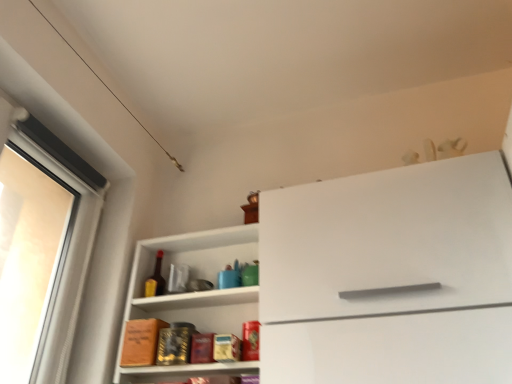
Question: Considering the positions of point (153, 284) and point (373, 357), is point (153, 284) closer or farther from the camera than point (373, 357)?

Choices:
 (A) closer
 (B) farther

Answer: (B)

Question: From the image's perspective, is matte glass bottle at center located above or below white matte cabinet at center?

Choices:
 (A) above
 (B) below

Answer: (B)

Question: Which is nearer to the white matte cabinet at center?

Choices:
 (A) matte glass bottle at center
 (B) white glossy shelf at center

Answer: (B)

Question: Estimate the real-world distances between objects in this image. Which object is closer to the matte glass bottle at center?

Choices:
 (A) white glossy shelf at center
 (B) white matte cabinet at center

Answer: (A)